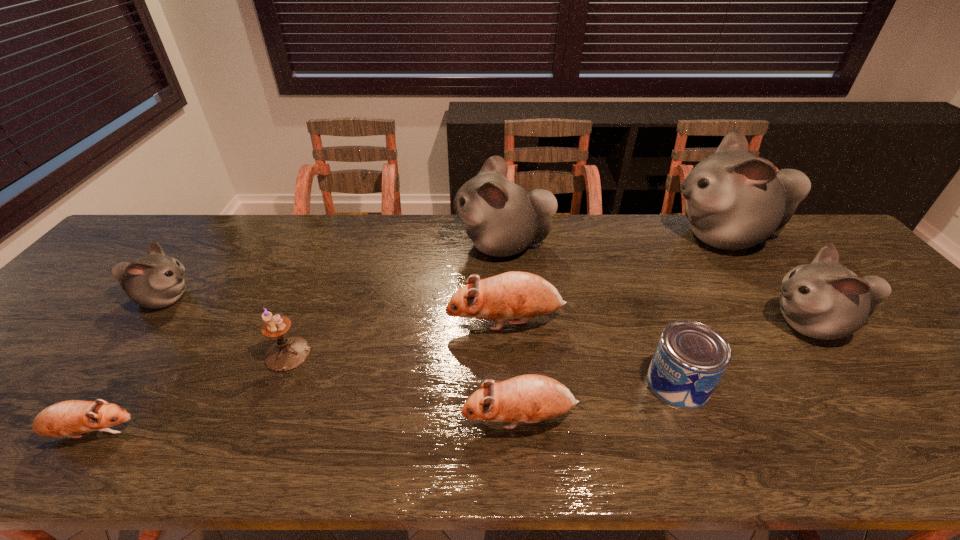
I want to click on can, so click(x=691, y=357).

I want to click on blue can, so click(x=691, y=357).

Where is `the sixth tallest hamster`? The height and width of the screenshot is (540, 960). the sixth tallest hamster is located at coordinates (531, 398).

I want to click on the shortest object, so click(70, 418).

Where is `the shortest hamster`? This screenshot has height=540, width=960. the shortest hamster is located at coordinates (70, 418).

Locate an element on the screen. Image resolution: width=960 pixels, height=540 pixels. vacant region located on the face of the tallest hamster is located at coordinates (610, 237).

This screenshot has height=540, width=960. I want to click on free space located 0.300m on the face of the tallest hamster, so (572, 237).

This screenshot has width=960, height=540. Find the location of `vacant space located 0.300m on the face of the tallest hamster`. vacant space located 0.300m on the face of the tallest hamster is located at coordinates (572, 237).

The image size is (960, 540). In order to click on free location located on the face of the second white hamster from left to right in this screenshot , I will do `click(339, 245)`.

At what (x,y) coordinates should I click in order to perform the action: click on free space located on the face of the second white hamster from left to right. Please return your answer as a coordinate pair (x, y). This screenshot has height=540, width=960. Looking at the image, I should click on (365, 245).